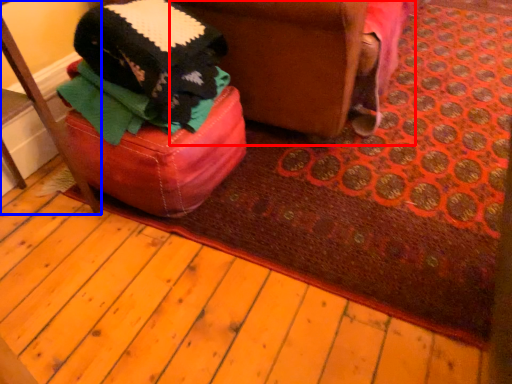
Question: Among these objects, which one is nearest to the camera, swivel chair (highlighted by a red box) or furniture (highlighted by a blue box)?

Choices:
 (A) swivel chair
 (B) furniture

Answer: (B)